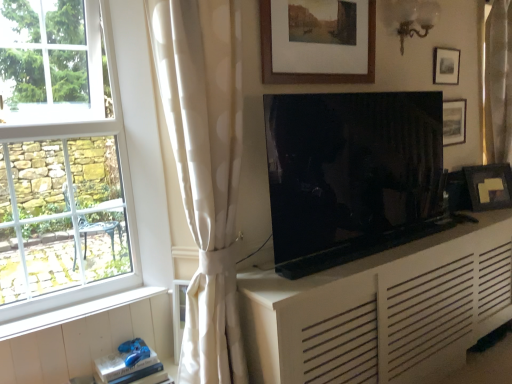
Find the location of a particular element. The height and width of the screenshot is (384, 512). free space in front of matte black picture frame at right, the first picture frame in the right-to-left sequence is located at coordinates (490, 213).